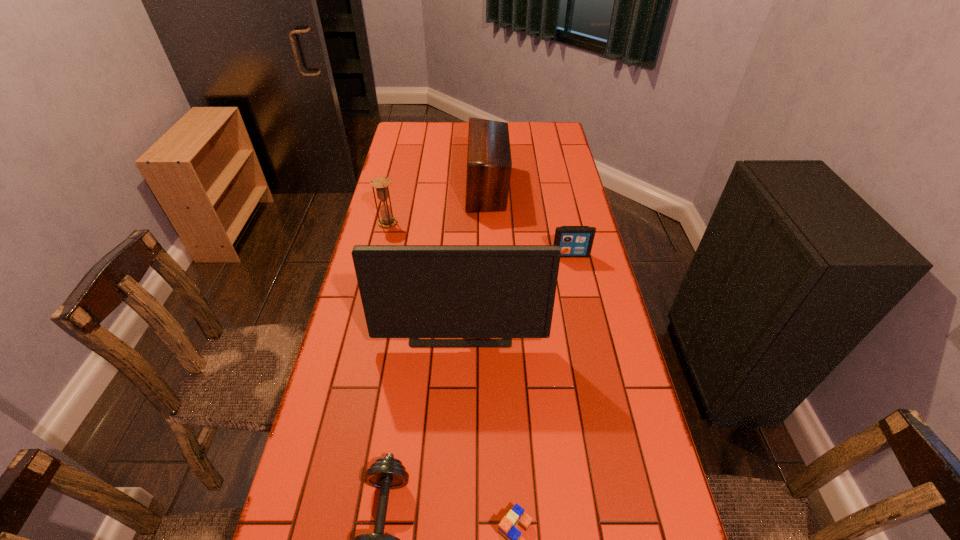
Identify the location of the fourth farthest object. The width and height of the screenshot is (960, 540). (408, 291).

This screenshot has height=540, width=960. I want to click on computer monitor, so click(408, 291).

Identify the location of the farthest object. (489, 164).

Identify the location of the second tallest object. (489, 164).

Locate an element on the screen. The image size is (960, 540). hourglass is located at coordinates (381, 184).

At what (x,y) coordinates should I click in order to perform the action: click on the leftmost object. Please return your answer as a coordinate pair (x, y). The image size is (960, 540). Looking at the image, I should click on (381, 184).

The height and width of the screenshot is (540, 960). I want to click on the rightmost object, so click(x=574, y=241).

Where is `the third farthest object`? This screenshot has height=540, width=960. the third farthest object is located at coordinates (574, 241).

The width and height of the screenshot is (960, 540). I want to click on free region located on the screen side of the tallest object, so click(x=457, y=435).

Locate an element on the screen. free point located on the front-facing side of the radio receiver is located at coordinates (400, 187).